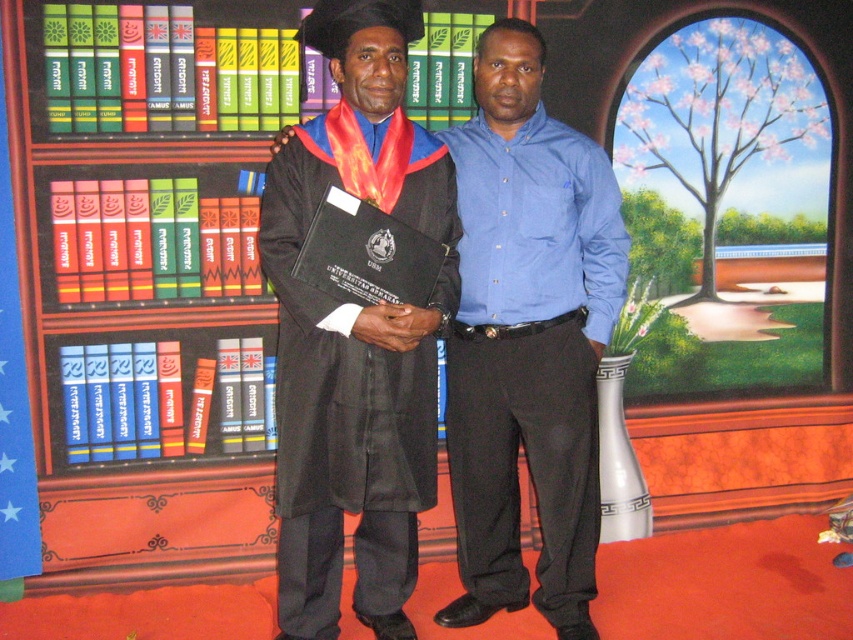
Based on the photo, you are standing in the room and want to place a new bookshelf at the exact location of point (134, 348). Is there already an object at this point?

Yes, there is a wooden bookcase at left located at point (134, 348).

You are a photographer adjusting the lighting for a portrait. The matte black robe at center is at point 0.555 on the x axis and 0.623 on the y axis. To ensure even lighting, you need to position a spotlight directly above the robe. What coordinates should the spotlight be placed at?

The spotlight should be placed at coordinates x 0.555 and y 0.623 to be directly above the matte black robe at center.

You are standing in a room and see the matte black robe at center. If you want to reach it without moving your feet, can you do so?

The matte black robe at center is 7.98 feet away from the viewer. Since this distance is greater than the typical human arm length of around 3 feet, you cannot reach it without moving your feet.